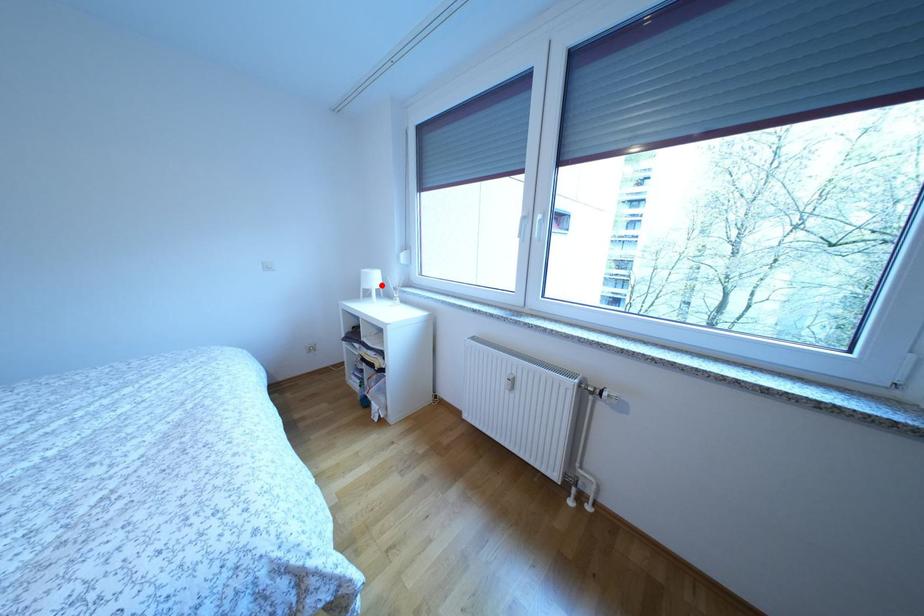
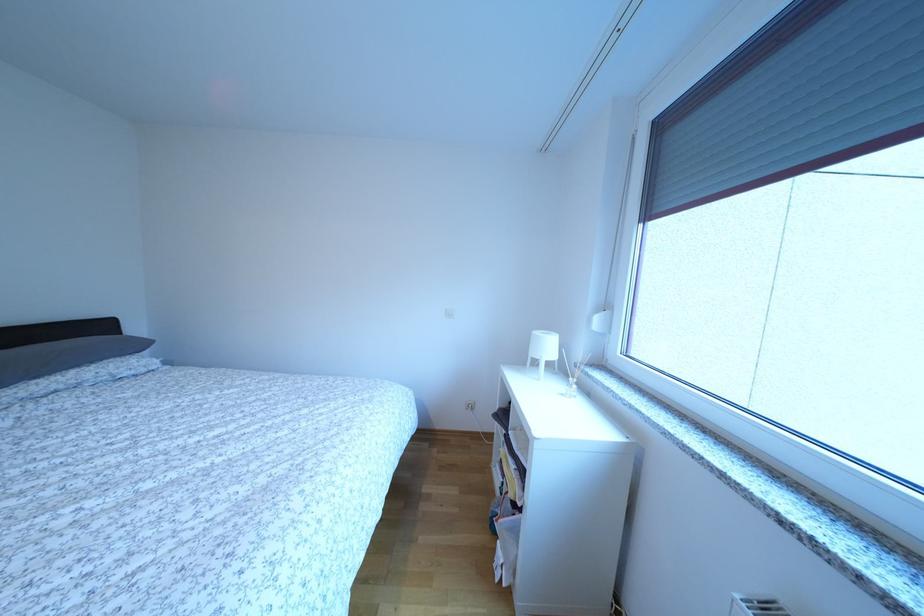
Locate, in the second image, the point that corresponds to the highlighted location in the first image.

(554, 353)